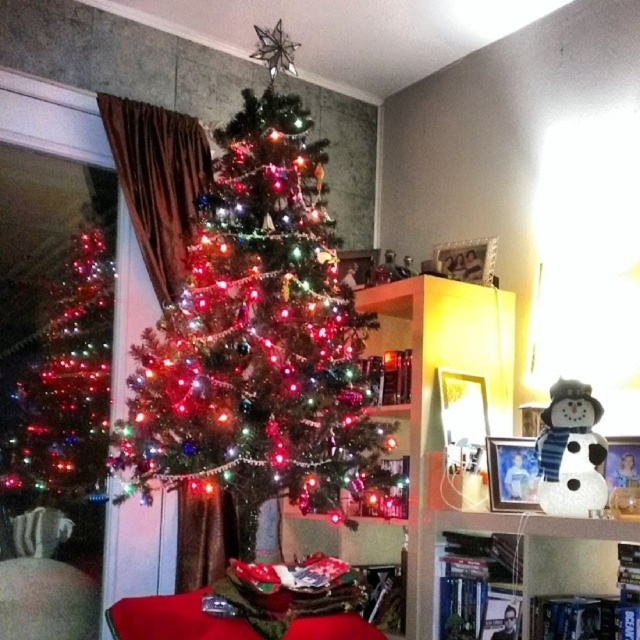
You are a guest at a Christmas party and want to take a photo of both the shiny metallic christmas tree at left and the white glittery snowman at lower right. Based on their positions, can you stand in a spot where both are visible in the same frame?

The shiny metallic christmas tree at left is positioned over white glittery snowman at lower right, so if you stand to the side where both are in your line of sight, you can capture both in the same photo.

You are planning to place a new large decoration between the wooden bookshelf at center and the shiny metallic christmas tree at left. Based on their widths, which object should you position closer to the center of the room to ensure the decoration fits properly?

The wooden bookshelf at center is wider than the shiny metallic christmas tree at left. To ensure the decoration fits properly, position the wooden bookshelf at center closer to the center of the room since its greater width requires more space.